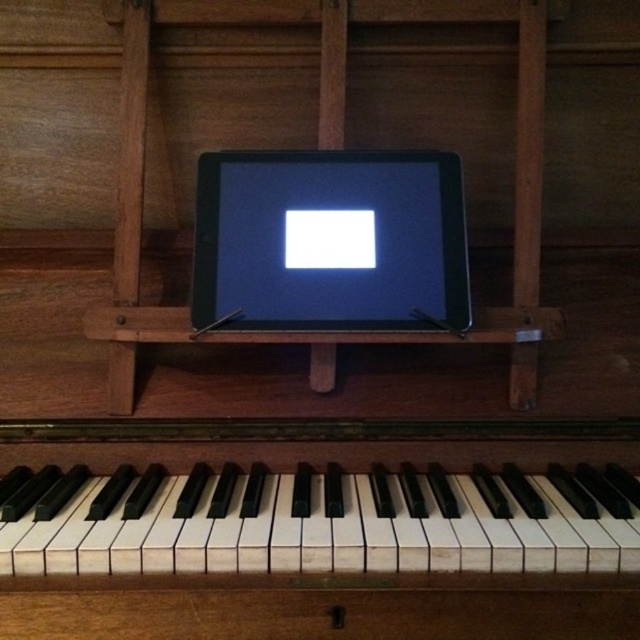
You are a piano teacher trying to place a 24 inch ruler between the white matte piano keys at center. Will the ruler fit between them?

The white matte piano keys at center are 26.30 inches apart, so the 24 inch ruler will fit between them since it is shorter than the distance between the keys.

You are a musician preparing for a performance. You need to place a small music stand between the white matte piano keys at center and the black glossy tablet at center. Given that the music stand is 15 cm wide, can it fit between them without overlapping either object?

The white matte piano keys at center is larger in size than the black glossy tablet at center, so there is sufficient space between them to place a 15 cm wide music stand without overlapping either object.

Looking at this image, you are a musician trying to place a 10 cm tall music stand between the white matte piano keys at center and the black glossy tablet at center. Can the music stand fit vertically between them?

The white matte piano keys at center is shorter than the black glossy tablet at center. Since the music stand is 10 cm tall, it can fit vertically between them as long as the vertical space between the two objects is at least 10 cm.